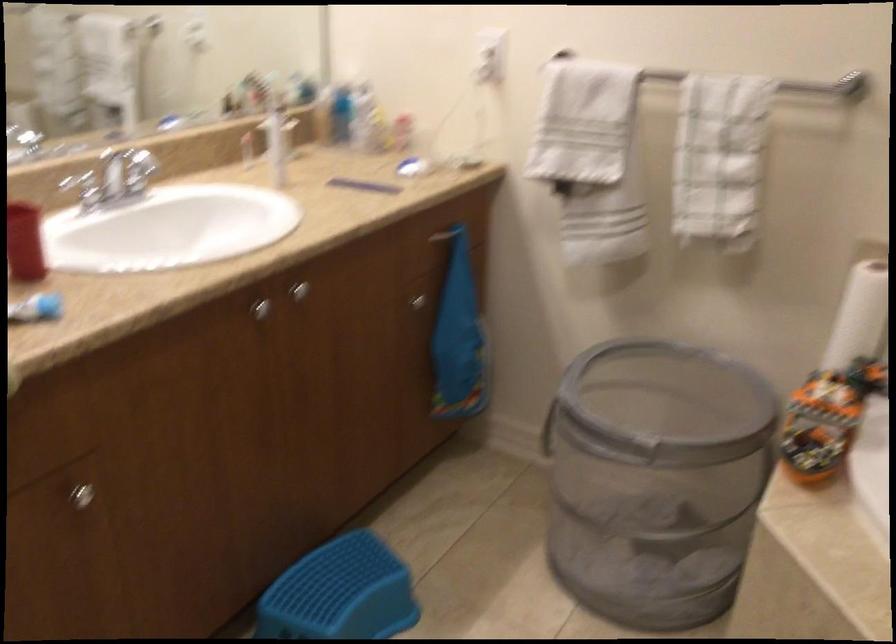
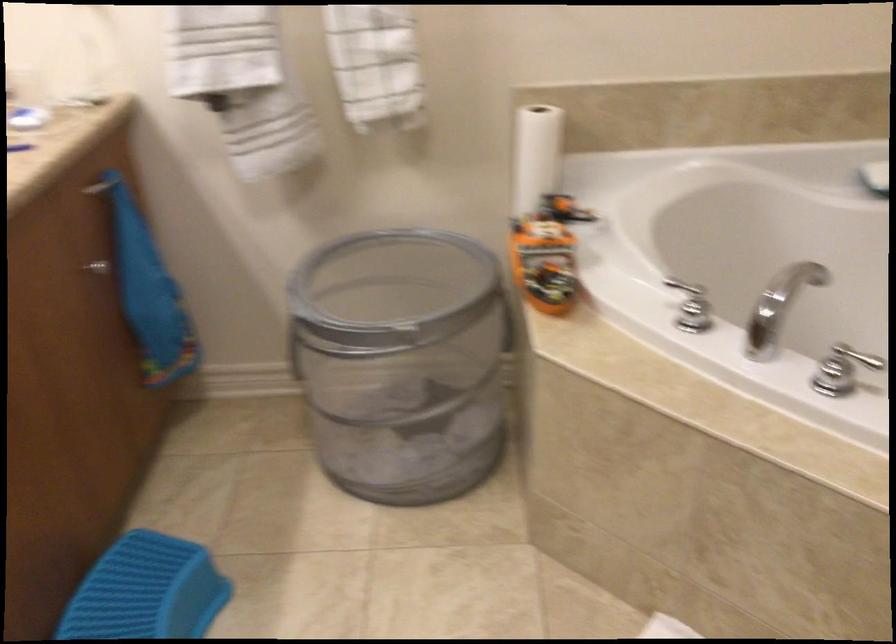
The point at (556, 420) is marked in the first image. Where is the corresponding point in the second image?

(303, 341)